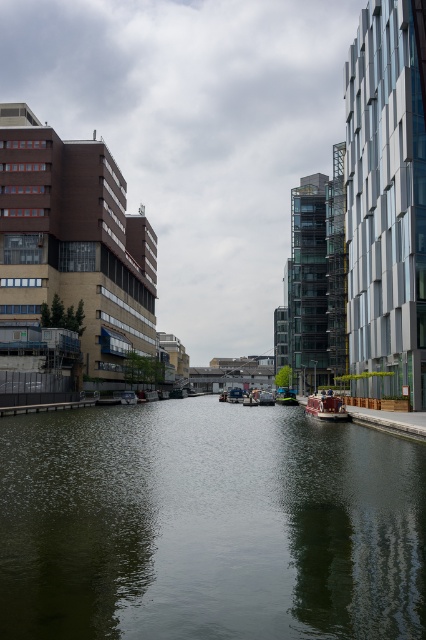
Who is taller, green reflective water at center or wooden polished boat at center?

With more height is wooden polished boat at center.

Is green reflective water at center positioned behind wooden polished boat at center?

No.

The image size is (426, 640). Find the location of `green reflective water at center`. green reflective water at center is located at coordinates (209, 525).